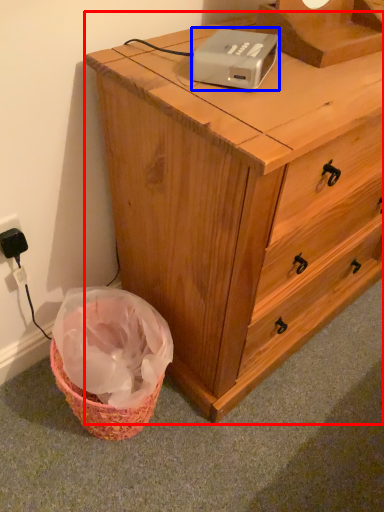
Question: Among these objects, which one is nearest to the camera, chest of drawers (highlighted by a red box) or gadget (highlighted by a blue box)?

Choices:
 (A) chest of drawers
 (B) gadget

Answer: (A)